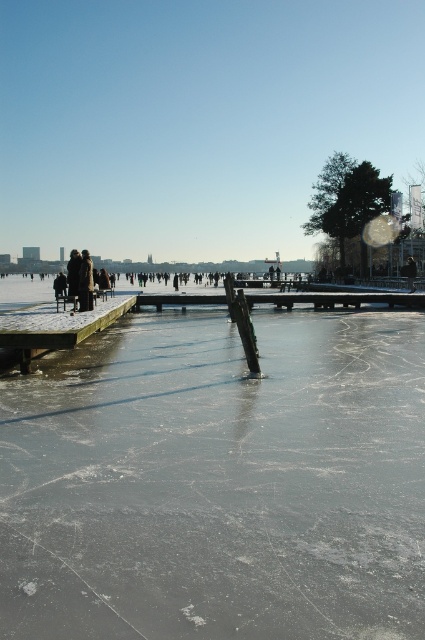
Can you confirm if smooth ice rink at center is positioned below wooden dock at left?

Correct, smooth ice rink at center is located below wooden dock at left.

The height and width of the screenshot is (640, 425). What are the coordinates of `smooth ice rink at center` in the screenshot? It's located at (218, 481).

The height and width of the screenshot is (640, 425). Describe the element at coordinates (218, 481) in the screenshot. I see `smooth ice rink at center` at that location.

Find the location of a particular element. The width and height of the screenshot is (425, 640). smooth ice rink at center is located at coordinates (218, 481).

The image size is (425, 640). In order to click on wooden dock at left in this screenshot , I will do `click(57, 336)`.

Is point (25, 337) in front of point (82, 308)?

That is True.

Does point (23, 337) lie in front of point (87, 285)?

Yes, it is in front of point (87, 285).

Locate an element on the screen. The height and width of the screenshot is (640, 425). wooden dock at left is located at coordinates (57, 336).

Is the position of dark brown leather jacket at left more distant than that of dark brown fur coat at left?

No, it is in front of dark brown fur coat at left.

Does point (79, 284) come closer to viewer compared to point (68, 266)?

Yes, it is in front of point (68, 266).

Locate an element on the screen. This screenshot has width=425, height=640. dark brown leather jacket at left is located at coordinates (85, 282).